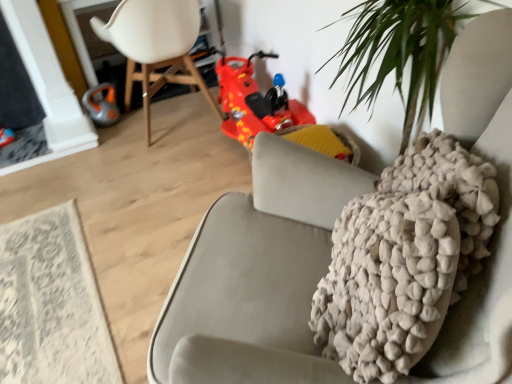
Find the location of a particular element. vacant space situated on the left part of shiny red plastic toy car at center is located at coordinates (178, 161).